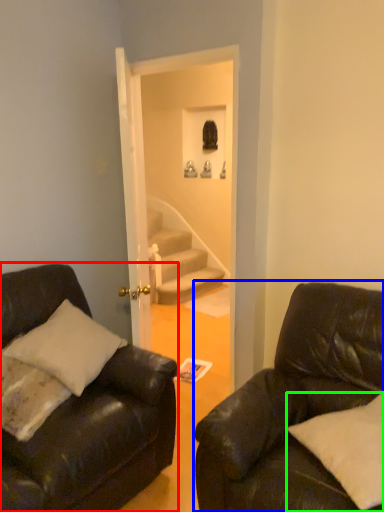
Question: Based on their relative distances, which object is nearer to studio couch (highlighted by a red box)? Choose from studio couch (highlighted by a blue box) and pillow (highlighted by a green box).

Choices:
 (A) studio couch
 (B) pillow

Answer: (A)